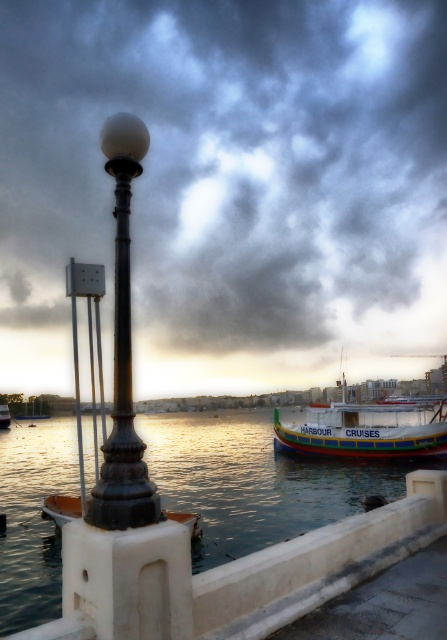
You are a photographer setting up a tripod to capture the scene. You want to ensure that the matte black lamp post at center and the clear water at lower center are both in the frame. Given their sizes, which object will require more space horizontally in your composition?

The matte black lamp post at center requires more horizontal space in the composition because its width is larger than the clear water at lower center.

What is the significance of the point marked at coordinates [252,481] in the coastal scene?

The point marked at coordinates [252,481] indicates the location of clear water at lower center in the coastal scene.